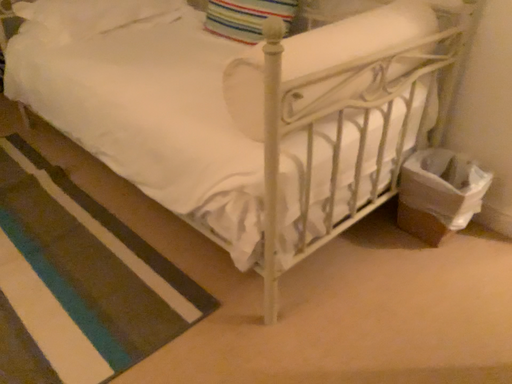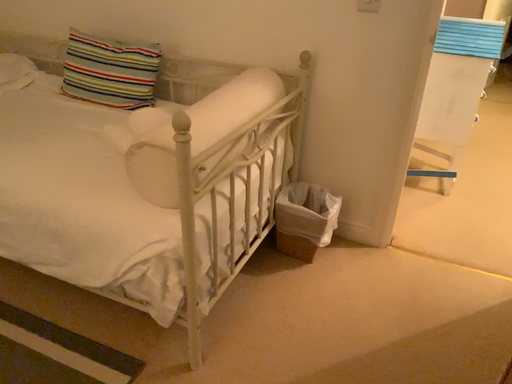
Question: Which way did the camera rotate in the video?

Choices:
 (A) rotated left
 (B) rotated right

Answer: (B)